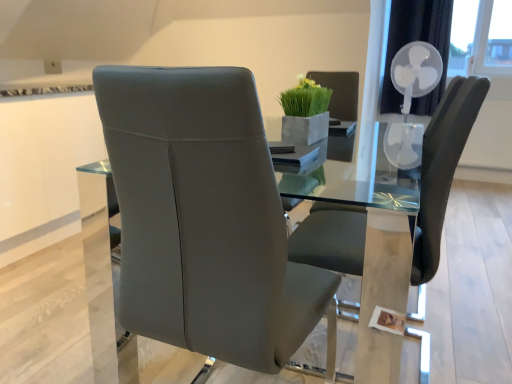
Question: In which direction should I rotate to look at satin grey leather chair at center, which is counted as the 2th chair, starting from the right?

Choices:
 (A) right
 (B) left

Answer: (B)

Question: Is green matte vase at upper center at the back of matte gray chair at center, the 2th chair positioned from the left?

Choices:
 (A) yes
 (B) no

Answer: (B)

Question: Does matte gray chair at center, the 2th chair positioned from the left, have a larger size compared to green matte vase at upper center?

Choices:
 (A) no
 (B) yes

Answer: (B)

Question: From a real-world perspective, is matte gray chair at center, the 2th chair positioned from the left, positioned over green matte vase at upper center based on gravity?

Choices:
 (A) yes
 (B) no

Answer: (B)

Question: Can you confirm if matte gray chair at center, the 2th chair positioned from the left, is taller than green matte vase at upper center?

Choices:
 (A) yes
 (B) no

Answer: (A)

Question: Considering the relative positions of matte gray chair at center, marked as the 1th chair in a right-to-left arrangement, and green matte vase at upper center in the image provided, is matte gray chair at center, marked as the 1th chair in a right-to-left arrangement, to the left of green matte vase at upper center from the viewer's perspective?

Choices:
 (A) no
 (B) yes

Answer: (A)

Question: Is matte gray chair at center, the 2th chair positioned from the left, wider than green matte vase at upper center?

Choices:
 (A) yes
 (B) no

Answer: (A)

Question: From the image's perspective, is satin grey leather chair at center, which is counted as the 2th chair, starting from the right, located above green matte vase at upper center?

Choices:
 (A) yes
 (B) no

Answer: (B)

Question: Is green matte vase at upper center at the back of satin grey leather chair at center, the first chair from the left?

Choices:
 (A) no
 (B) yes

Answer: (A)

Question: From a real-world perspective, does satin grey leather chair at center, the first chair from the left, stand above green matte vase at upper center?

Choices:
 (A) yes
 (B) no

Answer: (B)

Question: Is satin grey leather chair at center, the first chair from the left, positioned before green matte vase at upper center?

Choices:
 (A) yes
 (B) no

Answer: (A)

Question: Considering the relative sizes of satin grey leather chair at center, the first chair from the left, and green matte vase at upper center in the image provided, is satin grey leather chair at center, the first chair from the left, wider than green matte vase at upper center?

Choices:
 (A) no
 (B) yes

Answer: (B)

Question: Is satin grey leather chair at center, the first chair from the left, smaller than green matte vase at upper center?

Choices:
 (A) no
 (B) yes

Answer: (A)

Question: Is satin grey leather chair at center, which is counted as the 2th chair, starting from the right, oriented towards white plastic fan at upper right?

Choices:
 (A) yes
 (B) no

Answer: (A)